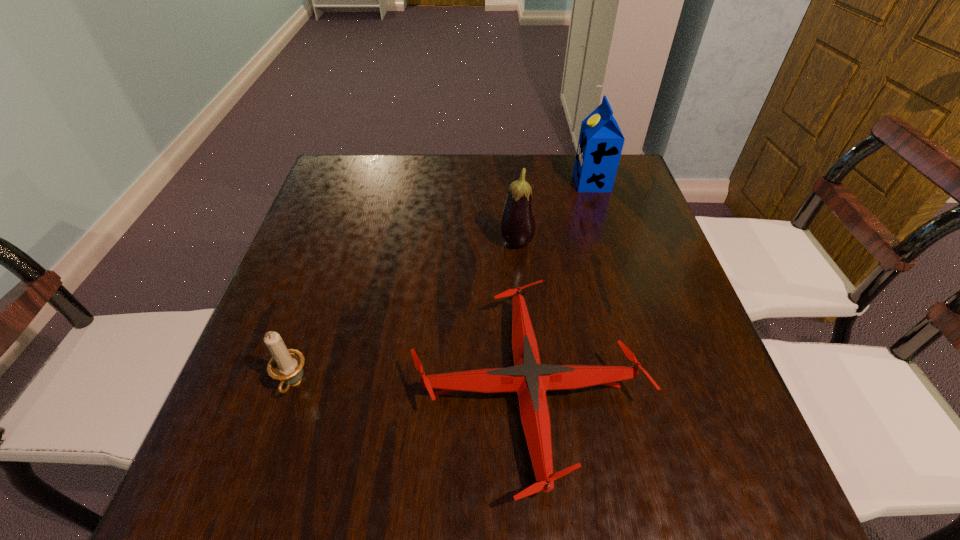
The height and width of the screenshot is (540, 960). I want to click on carton, so click(600, 144).

Locate an element on the screen. This screenshot has width=960, height=540. the third nearest object is located at coordinates (517, 225).

Image resolution: width=960 pixels, height=540 pixels. Find the location of `the third tallest object`. the third tallest object is located at coordinates (286, 365).

This screenshot has height=540, width=960. What are the coordinates of `the leftmost object` in the screenshot? It's located at (286, 365).

You are a GUI agent. You are given a task and a screenshot of the screen. Output one action in this format:
    pyautogui.click(x=<x>, y=<y>)
    Task: Click on the shortest object
    The image size is (960, 540).
    Given the screenshot: What is the action you would take?
    pyautogui.click(x=528, y=377)

Find the location of a particular element. vacant space located 0.110m with the cap open on the farthest object is located at coordinates (538, 183).

Identify the location of vacant space situated 0.170m with the cap open on the farthest object. This screenshot has height=540, width=960. (516, 183).

I want to click on free space located with the cap open on the farthest object, so pos(514,183).

The height and width of the screenshot is (540, 960). What are the coordinates of `vacant space located 0.290m on the back of the third nearest object` in the screenshot? It's located at (511, 170).

Where is `free space located 0.130m on the handle side of the candle_holder`? Image resolution: width=960 pixels, height=540 pixels. free space located 0.130m on the handle side of the candle_holder is located at coordinates (263, 478).